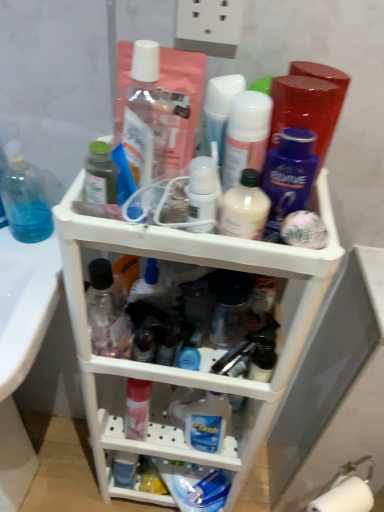
Question: Is white plastic shelf at center taller than transparent plastic bottle at center, acting as the first toiletry starting from the left?

Choices:
 (A) no
 (B) yes

Answer: (B)

Question: Can you confirm if white plastic shelf at center is smaller than transparent plastic bottle at center, acting as the first toiletry starting from the left?

Choices:
 (A) yes
 (B) no

Answer: (B)

Question: Is white plastic shelf at center positioned with its back to transparent plastic bottle at center, acting as the first toiletry starting from the left?

Choices:
 (A) no
 (B) yes

Answer: (B)

Question: From the image's perspective, is white plastic shelf at center beneath transparent plastic bottle at center, acting as the first toiletry starting from the left?

Choices:
 (A) no
 (B) yes

Answer: (B)

Question: Could you tell me if white plastic shelf at center is facing transparent plastic bottle at center, which is the 8th toiletry in right-to-left order?

Choices:
 (A) yes
 (B) no

Answer: (A)

Question: In terms of height, does matte white lotion at center, the sixth toiletry in the left-to-right sequence, look taller or shorter compared to white plastic shelf at center?

Choices:
 (A) short
 (B) tall

Answer: (A)

Question: Considering the positions of point (253, 165) and point (266, 431), is point (253, 165) closer or farther from the camera than point (266, 431)?

Choices:
 (A) farther
 (B) closer

Answer: (B)

Question: Is matte white lotion at center, the sixth toiletry in the left-to-right sequence, in front of or behind white plastic shelf at center in the image?

Choices:
 (A) behind
 (B) front

Answer: (A)

Question: Do you think matte white lotion at center, the third toiletry when ordered from right to left, is within white plastic shelf at center, or outside of it?

Choices:
 (A) inside
 (B) outside

Answer: (B)

Question: Does point (246, 140) appear closer or farther from the camera than point (3, 177)?

Choices:
 (A) closer
 (B) farther

Answer: (A)

Question: From a real-world perspective, is matte white lotion at center, the sixth toiletry in the left-to-right sequence, above or below transparent plastic hand soap at left?

Choices:
 (A) below
 (B) above

Answer: (B)

Question: Would you say matte white lotion at center, the sixth toiletry in the left-to-right sequence, is to the left or to the right of transparent plastic hand soap at left in the picture?

Choices:
 (A) left
 (B) right

Answer: (B)

Question: Looking at their shapes, would you say matte white lotion at center, the sixth toiletry in the left-to-right sequence, is wider or thinner than transparent plastic hand soap at left?

Choices:
 (A) thin
 (B) wide

Answer: (A)

Question: Considering the positions of point (105, 193) and point (91, 312), is point (105, 193) closer or farther from the camera than point (91, 312)?

Choices:
 (A) farther
 (B) closer

Answer: (B)

Question: Is green matte bottle at upper left, which is the second toiletry in left-to-right order, wider or thinner than transparent plastic bottle at center, which is the 8th toiletry in right-to-left order?

Choices:
 (A) wide
 (B) thin

Answer: (B)